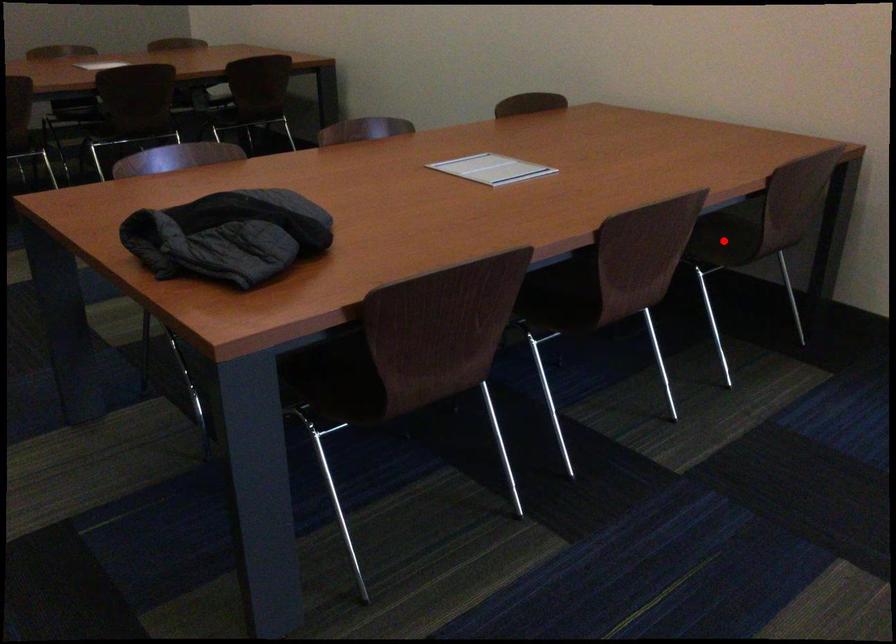
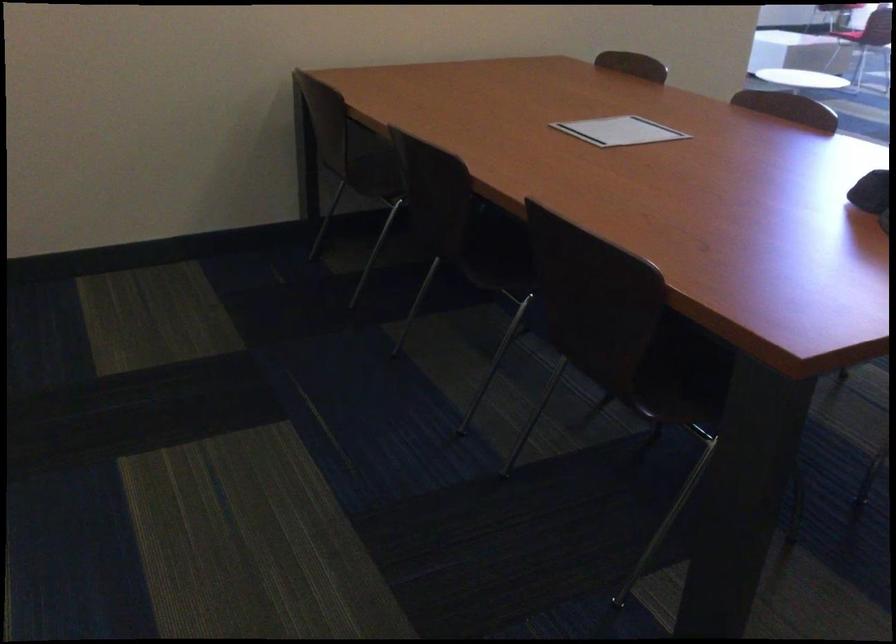
Question: I am providing you with two images of the same scene from different viewpoints. A red point is marked on the first image. At the location where the point appears in image 1, is it still visible in image 2?

Choices:
 (A) Yes
 (B) No

Answer: (B)